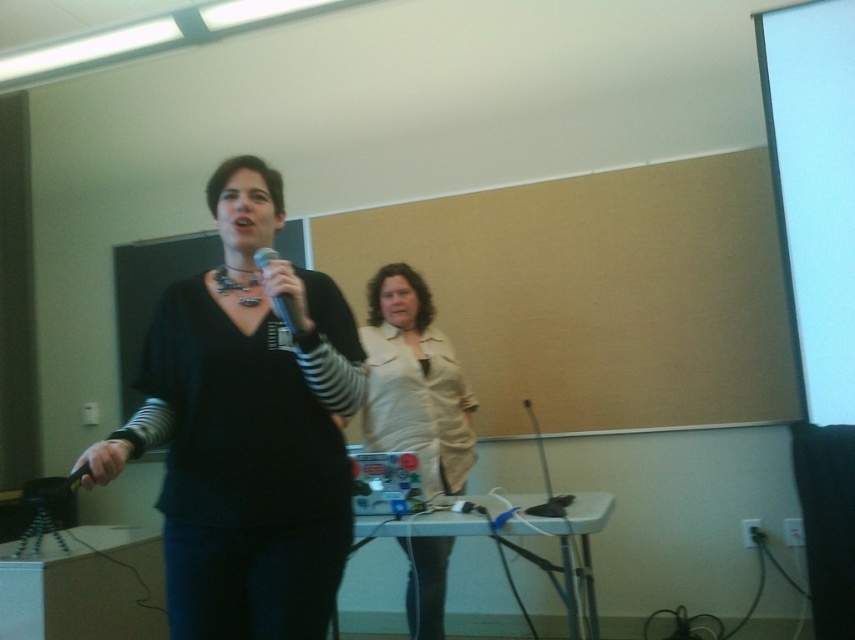
You are standing in the classroom and want to hang a poster on the wall. There are two points marked on the wall where you can place it. The first point is at coordinate point (326, 522) and the second is at point (836, 44). Which point is closer to your current position?

Point (326, 522) is closer to the camera than point (836, 44), so the first point is closer to your current position.

You are an event planner setting up a presentation area. You need to ensure that the matte black sweater at center and the matte black microphone at center are visible to the audience. Based on their positions, which object is closer to the floor?

The matte black sweater at center is below the matte black microphone at center, so the sweater is closer to the floor.